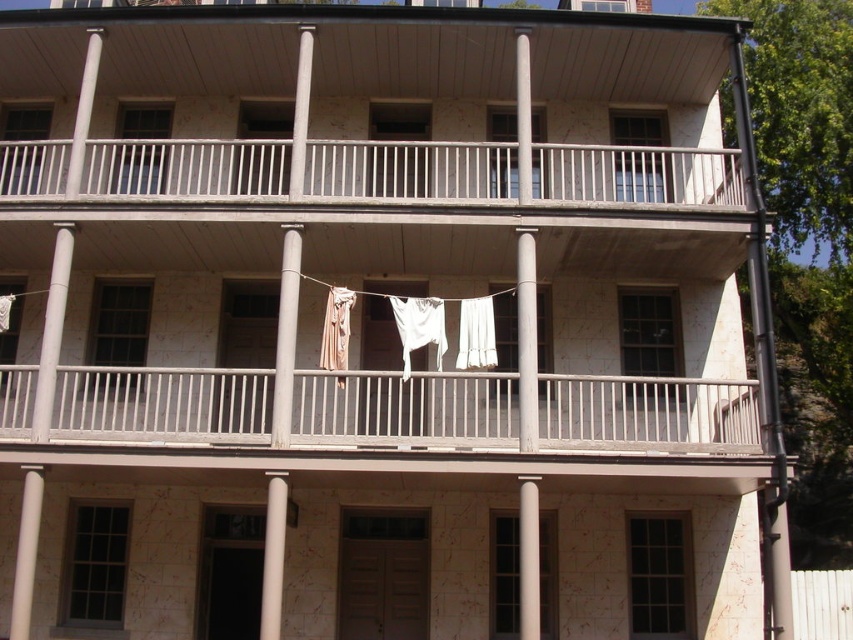
Question: Which of the following is the closest to the observer?

Choices:
 (A) wooden railings at center
 (B) white fabric at center

Answer: (A)

Question: Can you confirm if wooden railings at center is positioned below white fabric at center?

Choices:
 (A) yes
 (B) no

Answer: (A)

Question: Which object appears closest to the camera in this image?

Choices:
 (A) wooden railings at center
 (B) white fabric at center

Answer: (A)

Question: Where is wooden railings at center located in relation to white fabric at center in the image?

Choices:
 (A) above
 (B) below

Answer: (B)

Question: Which point is farther to the camera?

Choices:
 (A) wooden railings at center
 (B) white fabric at center

Answer: (B)

Question: From the image, what is the correct spatial relationship of wooden railings at center in relation to white fabric at center?

Choices:
 (A) right
 (B) left

Answer: (B)